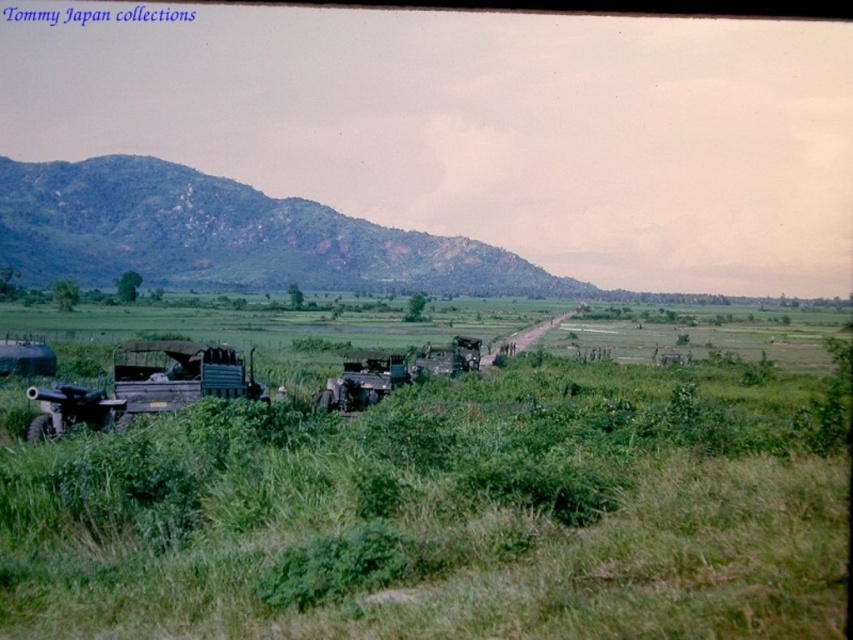
What is the coordinate of the green textured hillside at upper left?

The green textured hillside at upper left is located at coordinate point (230,236).

You are a soldier navigating through the rural landscape shown. You need to move from point A to point B. Point A is at coordinates point (x=169, y=205) and point B is at point (x=59, y=404). Which point is closer to the military trucks parked in the foreground?

Point (x=59, y=404) is closer to the military trucks parked in the foreground since it is in front of point (x=169, y=205) according to the spatial relationship provided.

You are a soldier positioned at the edge of the grassy area in front of the two military trucks. You need to reach the green textured hillside at upper left for a reconnaissance mission. What is the approximate distance you need to cover to reach it?

The green textured hillside at upper left is approximately 94.56 meters away from your current position.